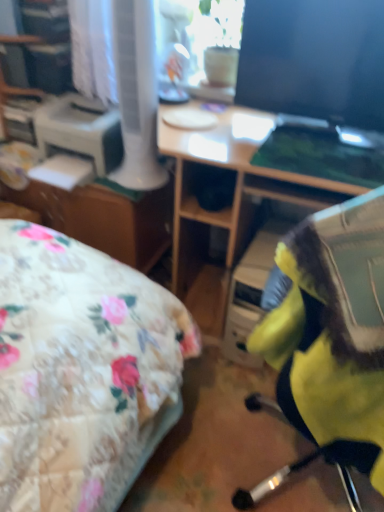
Question: Is point (132, 239) positioned closer to the camera than point (339, 329)?

Choices:
 (A) closer
 (B) farther

Answer: (B)

Question: Is matte brown file cabinet at center inside or outside of yellow fabric chair at center?

Choices:
 (A) inside
 (B) outside

Answer: (B)

Question: Estimate the real-world distances between objects in this image. Which object is closer to the matte brown file cabinet at center?

Choices:
 (A) wooden desk at center
 (B) white plastic printer at left
 (C) matte glass window screen at upper center
 (D) yellow fabric chair at center
 (E) matte black monitor at upper right

Answer: (B)

Question: Which object is the closest to the matte brown file cabinet at center?

Choices:
 (A) yellow fabric chair at center
 (B) matte black monitor at upper right
 (C) white plastic printer at left
 (D) wooden desk at center
 (E) matte glass window screen at upper center

Answer: (C)